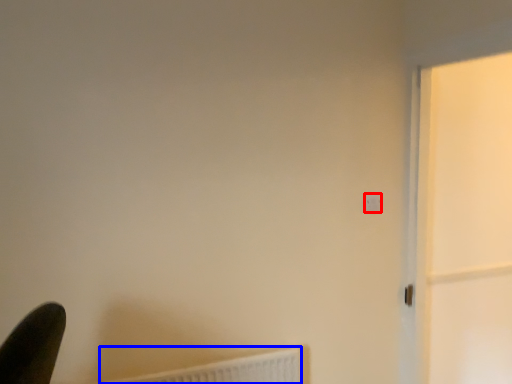
Question: Which point is closer to the camera, light switch (highlighted by a red box) or radiator (highlighted by a blue box)?

Choices:
 (A) light switch
 (B) radiator

Answer: (B)